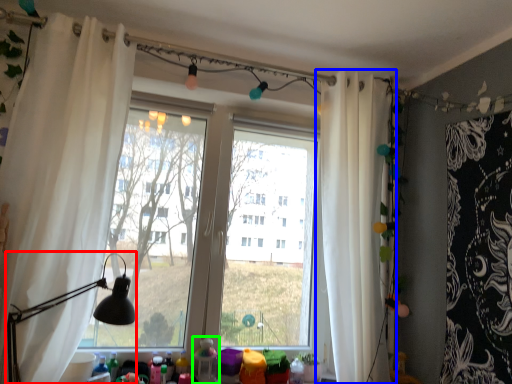
Question: Which object is the farthest from table lamp (highlighted by a red box)? Choose among these: curtain (highlighted by a blue box) or toy (highlighted by a green box).

Choices:
 (A) curtain
 (B) toy

Answer: (A)